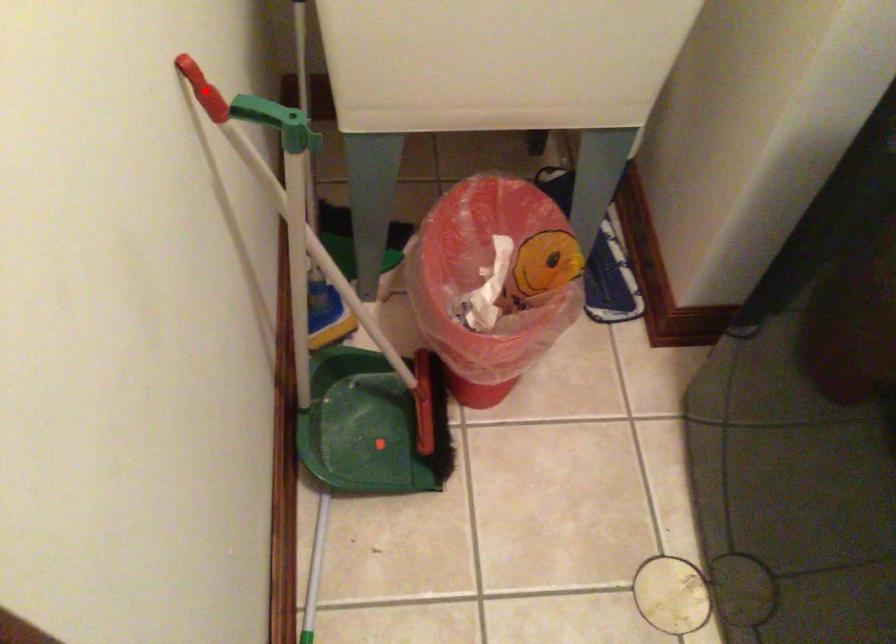
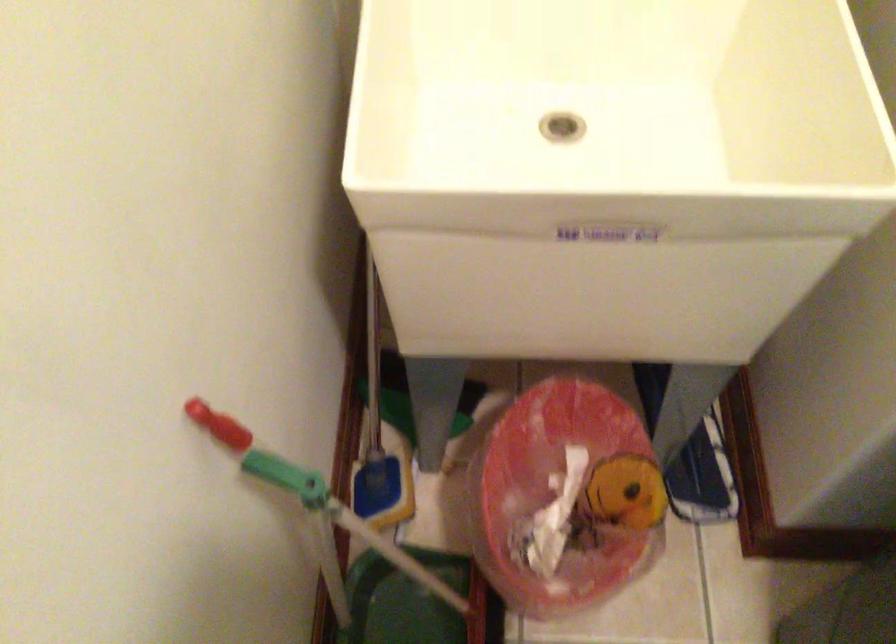
Question: I am providing you with two images of the same scene from different viewpoints. In image1, a red point is highlighted. Considering the same 3D point in image2, which of the following is correct?

Choices:
 (A) It is closer
 (B) It is farther

Answer: (A)